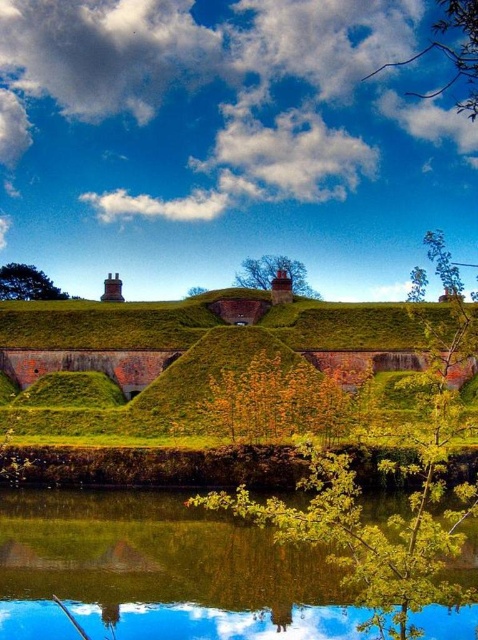
Looking at this image, you are standing at the base of the green grassy hillside at center and want to walk towards the green leafy tree at upper right. Which direction should you head to reach it?

The green leafy tree at upper right is behind the green grassy hillside at center, so you should walk towards the direction away from the hillside to reach it.